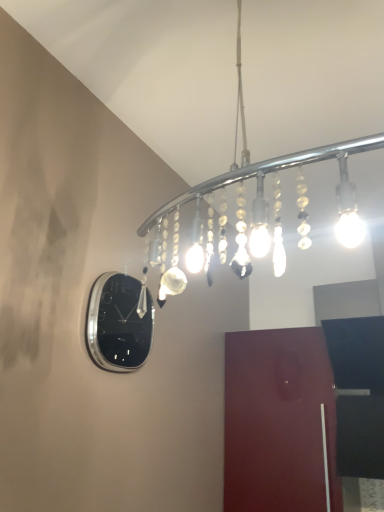
Question: From their relative heights in the image, would you say glossy wood door at lower right is taller or shorter than polished silver clock at upper left?

Choices:
 (A) tall
 (B) short

Answer: (A)

Question: From a real-world perspective, relative to polished silver clock at upper left, is glossy wood door at lower right vertically above or below?

Choices:
 (A) below
 (B) above

Answer: (A)

Question: Which of these objects is positioned farthest from the glossy wood door at lower right?

Choices:
 (A) polished silver clock at upper left
 (B) clear glass chandelier at upper center

Answer: (A)

Question: Estimate the real-world distances between objects in this image. Which object is closer to the glossy wood door at lower right?

Choices:
 (A) polished silver clock at upper left
 (B) clear glass chandelier at upper center

Answer: (B)